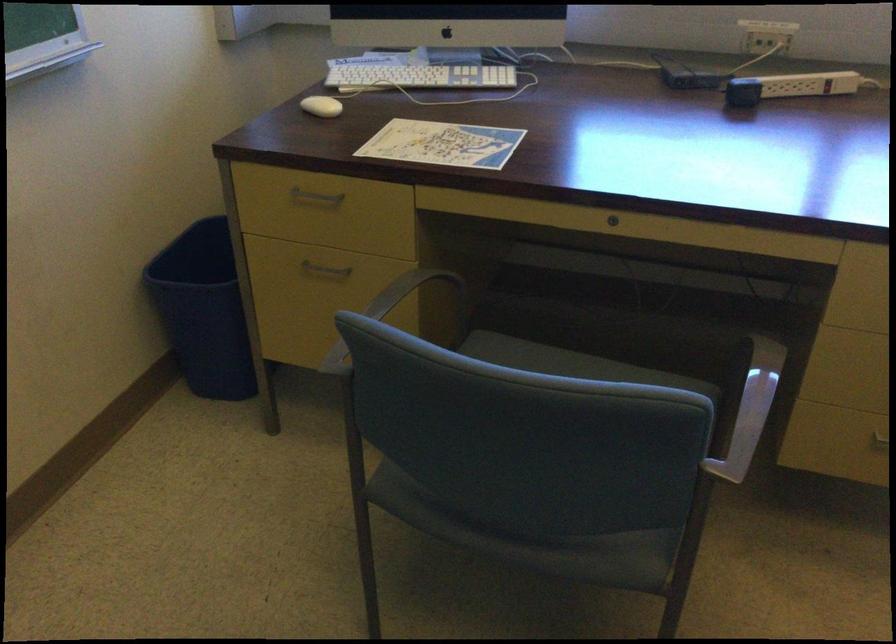
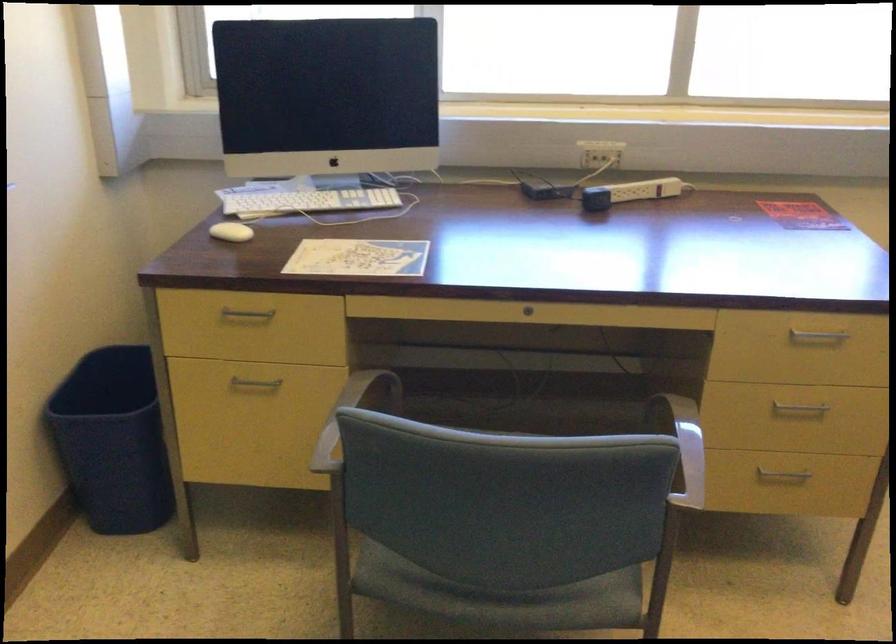
In the second image, find the point that corresponds to pixel 316 105 in the first image.

(230, 232)